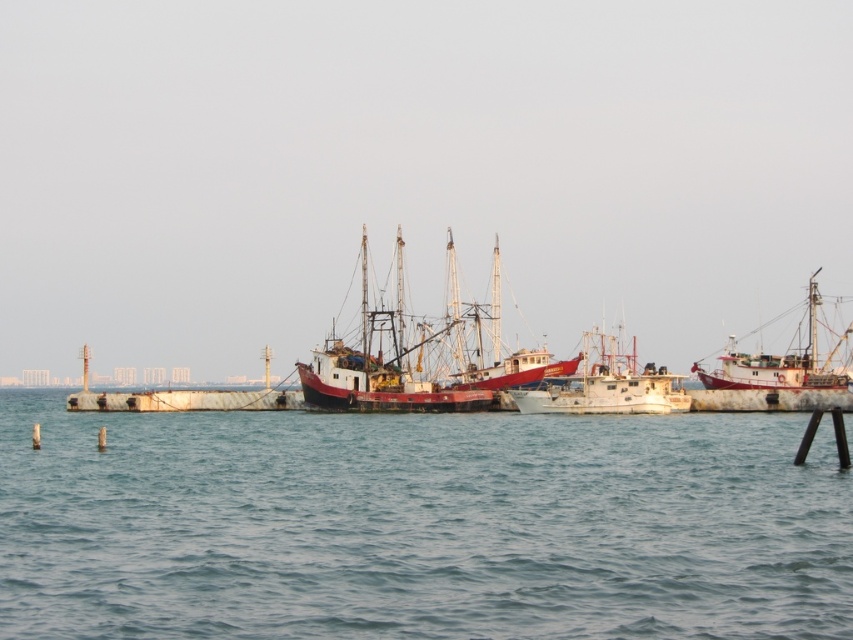
Is rustic wooden fishing boat at center positioned at the back of white matte fishing boat at right?

Yes, rustic wooden fishing boat at center is further from the viewer.

Does rustic wooden fishing boat at center appear over white matte fishing boat at right?

Correct, rustic wooden fishing boat at center is located above white matte fishing boat at right.

Is point (460, 340) closer to camera compared to point (793, 396)?

That is False.

This screenshot has width=853, height=640. I want to click on rustic wooden fishing boat at center, so click(x=422, y=355).

Does rustic wooden fishing boat at center appear on the left side of white matte boat at center?

Indeed, rustic wooden fishing boat at center is positioned on the left side of white matte boat at center.

Which is above, rustic wooden fishing boat at center or white matte boat at center?

rustic wooden fishing boat at center is above.

Is point (474, 364) farther from camera compared to point (624, 401)?

Yes, it is.

Where is `rustic wooden fishing boat at center`? The width and height of the screenshot is (853, 640). rustic wooden fishing boat at center is located at coordinates (422, 355).

At what (x,y) coordinates should I click in order to perform the action: click on blue water at center. Please return your answer as a coordinate pair (x, y). The image size is (853, 640). Looking at the image, I should click on (419, 525).

From the picture: Is blue water at center to the left of rustic wooden fishing boat at center from the viewer's perspective?

No, blue water at center is not to the left of rustic wooden fishing boat at center.

Does point (347, 596) come in front of point (432, 369)?

Yes, it is.

Where is `blue water at center`? Image resolution: width=853 pixels, height=640 pixels. blue water at center is located at coordinates (419, 525).